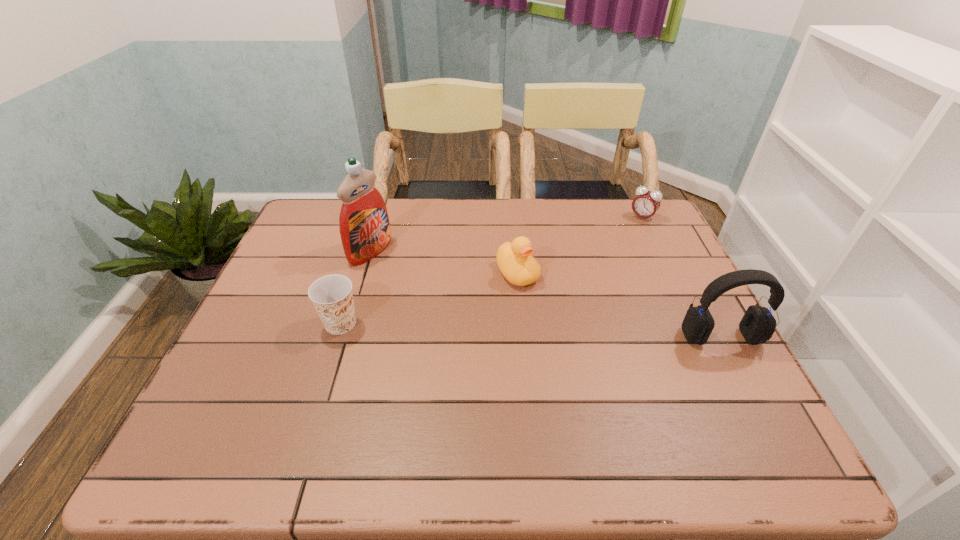
The width and height of the screenshot is (960, 540). In order to click on vacant area that lies between the Dixie cup and the third object from left to right in this screenshot , I will do `click(429, 299)`.

In order to click on vacant region between the Dixie cup and the duck in this screenshot , I will do `click(429, 299)`.

Image resolution: width=960 pixels, height=540 pixels. Find the location of `free spot between the Dixie cup and the second tallest object`. free spot between the Dixie cup and the second tallest object is located at coordinates (531, 330).

Find the location of `vacant area that lies between the tallest object and the second tallest object`. vacant area that lies between the tallest object and the second tallest object is located at coordinates (545, 294).

This screenshot has height=540, width=960. In order to click on free space between the Dixie cup and the detergent in this screenshot , I will do 355,287.

At what (x,y) coordinates should I click in order to perform the action: click on vacant space that is in between the alarm clock and the second tallest object. Please return your answer as a coordinate pair (x, y). Image resolution: width=960 pixels, height=540 pixels. Looking at the image, I should click on (682, 277).

You are a GUI agent. You are given a task and a screenshot of the screen. Output one action in this format:
    pyautogui.click(x=<x>, y=<y>)
    Task: Click on the vacant region between the third object from left to right and the fourth shortest object
    Image resolution: width=960 pixels, height=540 pixels.
    Given the screenshot: What is the action you would take?
    pyautogui.click(x=619, y=305)

Point out which object is positioned as the third nearest to the Dixie cup. Please provide its 2D coordinates. Your answer should be formatted as a tuple, i.e. [(x, y)], where the tuple contains the x and y coordinates of a point satisfying the conditions above.

[(758, 324)]

Locate which object is the fourth closest to the farthest object. Please provide its 2D coordinates. Your answer should be formatted as a tuple, i.e. [(x, y)], where the tuple contains the x and y coordinates of a point satisfying the conditions above.

[(332, 296)]

Identify the location of vacant area in the image that satisfies the following two spatial constraints: 1. on the back side of the Dixie cup; 2. on the left side of the detergent. (363, 251).